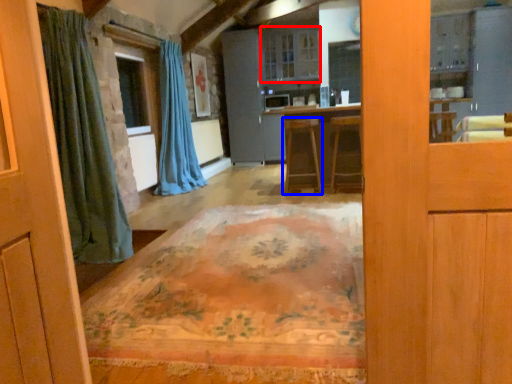
Question: Which object is further to the camera taking this photo, cabinetry (highlighted by a red box) or furniture (highlighted by a blue box)?

Choices:
 (A) cabinetry
 (B) furniture

Answer: (A)